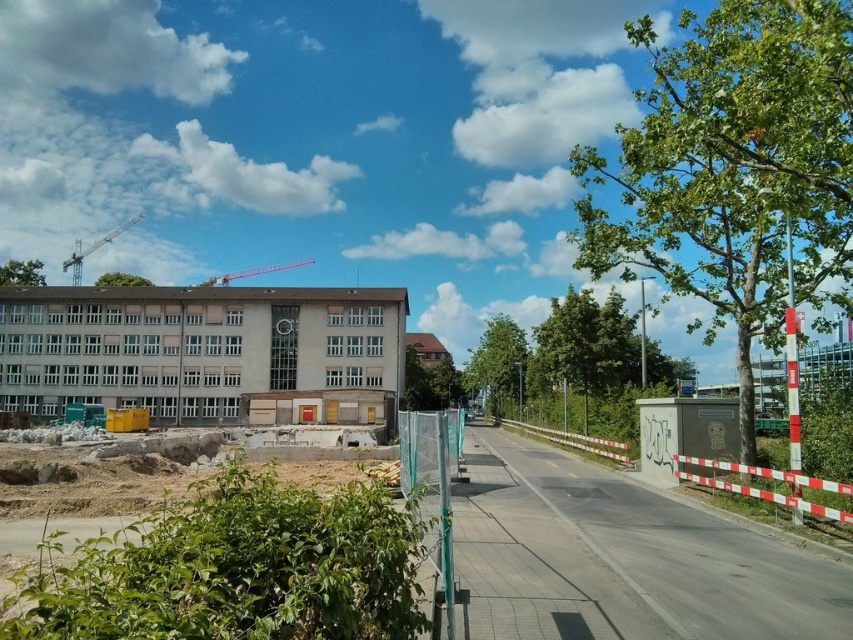
Is green leafy tree at right positioned behind metallic red crane at upper center?

No, it is not.

Describe the element at coordinates (734, 168) in the screenshot. I see `green leafy tree at right` at that location.

Measure the distance between green leafy tree at right and camera.

The distance of green leafy tree at right from camera is 8.87 meters.

This screenshot has height=640, width=853. What are the coordinates of `green leafy tree at right` in the screenshot? It's located at (734, 168).

In order to click on white/red striped barrier at right in this screenshot , I will do `click(764, 490)`.

Does white/red striped barrier at right have a greater width compared to green leafy tree at upper left?

Incorrect, white/red striped barrier at right's width does not surpass green leafy tree at upper left's.

What do you see at coordinates (764, 490) in the screenshot? I see `white/red striped barrier at right` at bounding box center [764, 490].

This screenshot has width=853, height=640. Identify the location of white/red striped barrier at right. (764, 490).

Is beige concrete building at center bigger than metallic red crane at upper center?

No, beige concrete building at center is not bigger than metallic red crane at upper center.

In order to click on beige concrete building at center in this screenshot , I will do `click(201, 349)`.